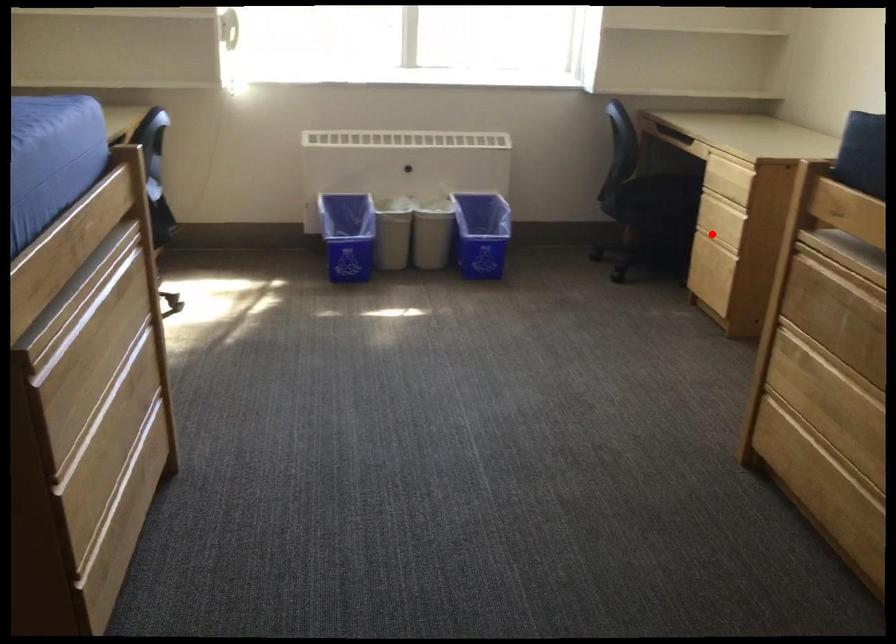
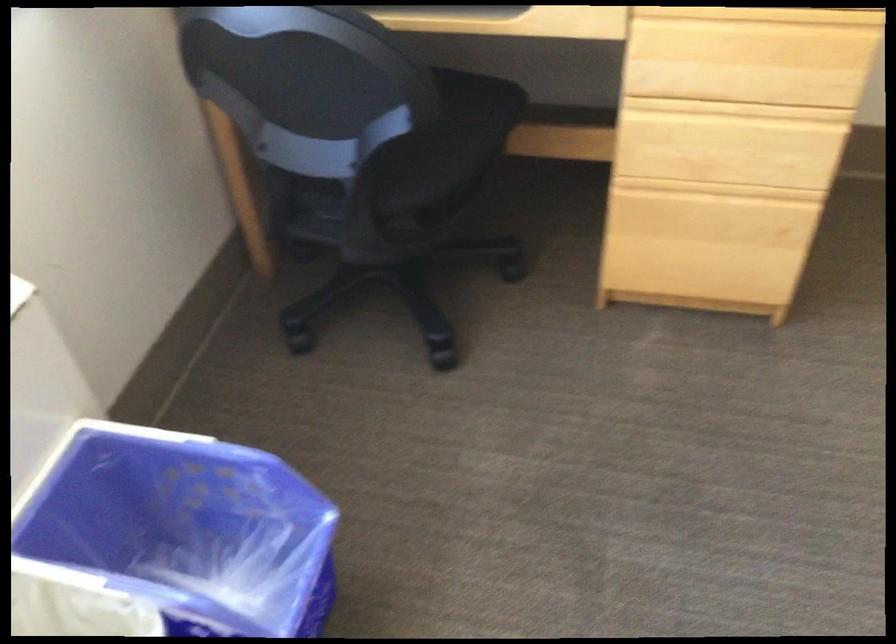
Question: I am providing you with two images of the same scene from different viewpoints. In image1, a red point is highlighted. Considering the same 3D point in image2, which of the following is correct?

Choices:
 (A) It is closer
 (B) It is farther

Answer: (A)